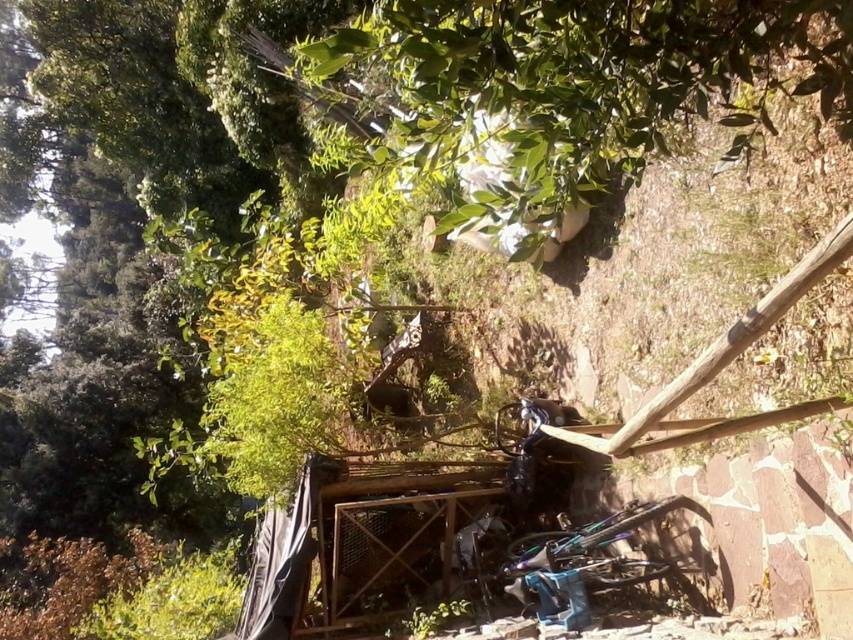
Can you confirm if green leafy tree at upper center is positioned to the right of shiny metallic bicycle at center?

In fact, green leafy tree at upper center is to the left of shiny metallic bicycle at center.

Based on the photo, how much distance is there between green leafy tree at upper center and shiny metallic bicycle at center?

A distance of 6.06 feet exists between green leafy tree at upper center and shiny metallic bicycle at center.

Does point (785, 8) come farther from viewer compared to point (569, 564)?

No, it is not.

Where is `green leafy tree at upper center`? Image resolution: width=853 pixels, height=640 pixels. green leafy tree at upper center is located at coordinates pyautogui.click(x=566, y=93).